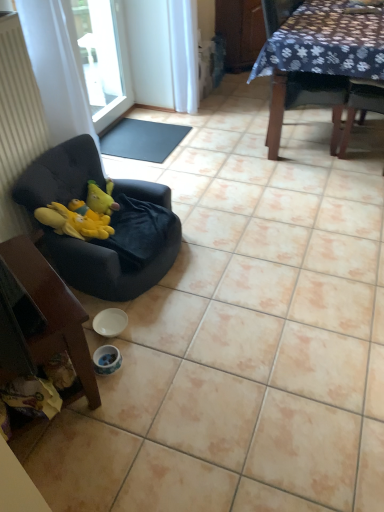
Question: Should I look upward or downward to see transparent glass window at upper left?

Choices:
 (A) up
 (B) down

Answer: (A)

Question: Does black rubber mat at center have a greater width compared to velvet black chair at left, the second chair when ordered from right to left?

Choices:
 (A) yes
 (B) no

Answer: (B)

Question: From a real-world perspective, is black rubber mat at center beneath velvet black chair at left, which is the second chair from top to bottom?

Choices:
 (A) no
 (B) yes

Answer: (B)

Question: Can you confirm if black rubber mat at center is thinner than velvet black chair at left, the second chair when ordered from right to left?

Choices:
 (A) yes
 (B) no

Answer: (A)

Question: Does black rubber mat at center appear on the right side of velvet black chair at left, which is the second chair from top to bottom?

Choices:
 (A) no
 (B) yes

Answer: (A)

Question: Does black rubber mat at center touch velvet black chair at left, marked as the 2th chair in a bottom-to-top arrangement?

Choices:
 (A) no
 (B) yes

Answer: (A)

Question: From the image's perspective, would you say black rubber mat at center is positioned over velvet black chair at left, the second chair when ordered from right to left?

Choices:
 (A) yes
 (B) no

Answer: (A)

Question: Considering the relative sizes of white glossy bowl at lower center and white fabric curtain at left in the image provided, is white glossy bowl at lower center bigger than white fabric curtain at left?

Choices:
 (A) yes
 (B) no

Answer: (B)

Question: Is white glossy bowl at lower center completely or partially outside of white fabric curtain at left?

Choices:
 (A) no
 (B) yes

Answer: (B)

Question: Considering the relative sizes of white glossy bowl at lower center and white fabric curtain at left in the image provided, is white glossy bowl at lower center smaller than white fabric curtain at left?

Choices:
 (A) yes
 (B) no

Answer: (A)

Question: Considering the relative positions of white glossy bowl at lower center and white fabric curtain at left in the image provided, is white glossy bowl at lower center to the right of white fabric curtain at left from the viewer's perspective?

Choices:
 (A) no
 (B) yes

Answer: (B)

Question: From a real-world perspective, is white glossy bowl at lower center physically above white fabric curtain at left?

Choices:
 (A) no
 (B) yes

Answer: (A)

Question: Is white glossy bowl at lower center shorter than white fabric curtain at left?

Choices:
 (A) yes
 (B) no

Answer: (A)

Question: Considering the relative sizes of white fabric curtain at left and transparent glass window at upper left in the image provided, is white fabric curtain at left smaller than transparent glass window at upper left?

Choices:
 (A) no
 (B) yes

Answer: (B)